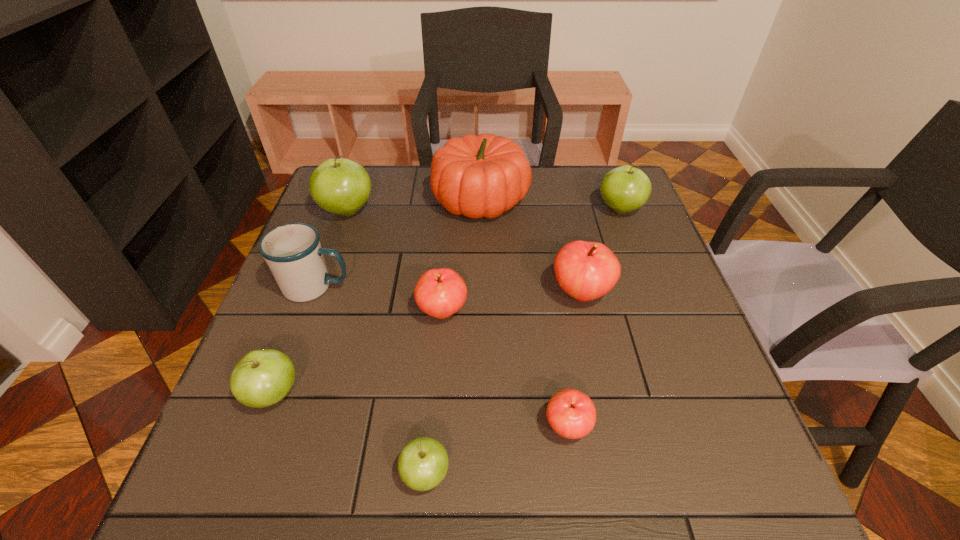
Find the location of a particular element. the smallest green apple is located at coordinates (423, 463).

This screenshot has height=540, width=960. Find the location of `vacant space located 0.240m on the right of the pumpkin`. vacant space located 0.240m on the right of the pumpkin is located at coordinates (612, 199).

Where is `vacant space situated 0.050m on the right of the tallest apple`? vacant space situated 0.050m on the right of the tallest apple is located at coordinates (394, 211).

The image size is (960, 540). Find the location of `free space located on the right of the biggest red apple`. free space located on the right of the biggest red apple is located at coordinates (642, 293).

Locate an element on the screen. vacant space located on the left of the third smallest green apple is located at coordinates (454, 209).

The height and width of the screenshot is (540, 960). Identify the location of vacant space situated on the handle side of the white mug. (510, 287).

You are a GUI agent. You are given a task and a screenshot of the screen. Output one action in this format:
    pyautogui.click(x=<x>, y=<y>)
    Task: Click on the vacant space located 0.190m on the right of the second biggest red apple
    The image size is (960, 540).
    Given the screenshot: What is the action you would take?
    tap(553, 312)

Identify the location of free space located 0.060m on the right of the third biggest green apple. This screenshot has width=960, height=540. (333, 394).

Identify the location of vacant space positioned on the left of the nearest red apple. (331, 427).

You are a GUI agent. You are given a task and a screenshot of the screen. Output one action in this format:
    pyautogui.click(x=<x>, y=<y>)
    Task: Click on the free point located 0.400m on the right of the nearest green apple
    This screenshot has height=540, width=960.
    Given the screenshot: What is the action you would take?
    pyautogui.click(x=692, y=474)